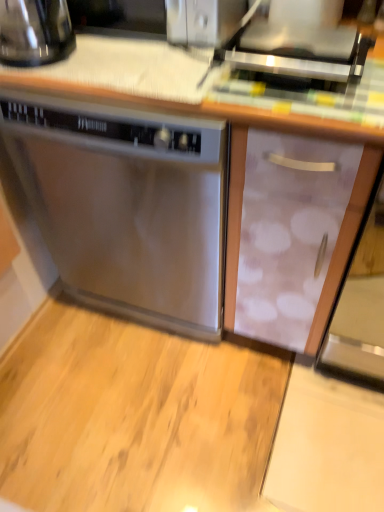
What are the coordinates of `free space above satin silver toaster at upper center (from a real-world perspective)` in the screenshot? It's located at (291, 44).